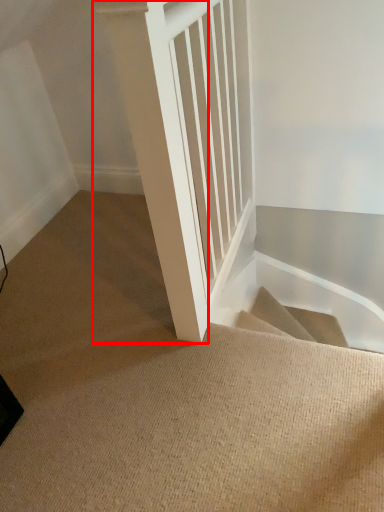
Question: From the image's perspective, what is the correct spatial positioning of pillar (annotated by the red box) in reference to stairs?

Choices:
 (A) above
 (B) below

Answer: (A)